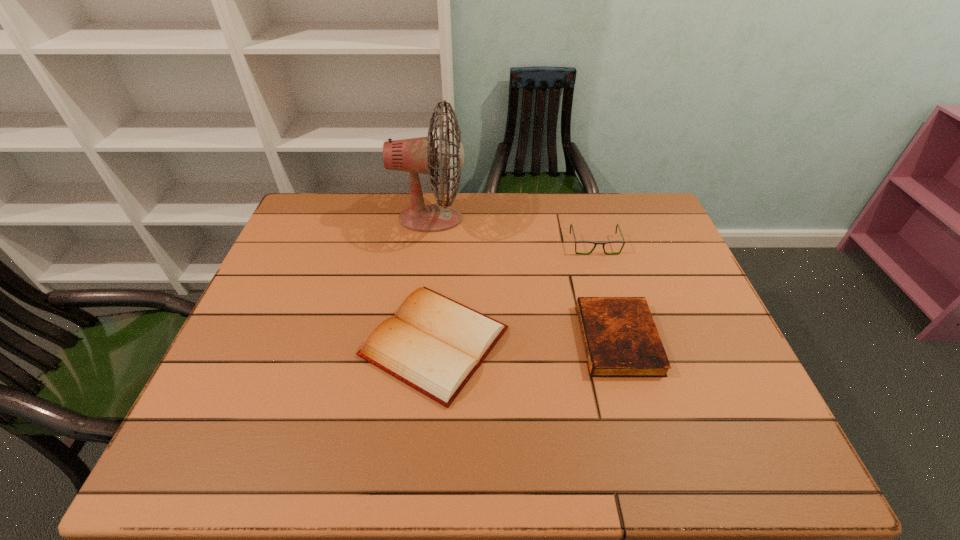
At what (x,y) coordinates should I click in order to perform the action: click on fan at the far edge. Please return your answer as a coordinate pair (x, y). Image resolution: width=960 pixels, height=540 pixels. Looking at the image, I should click on (416, 155).

Identify the location of spectacles that is at the far edge. This screenshot has height=540, width=960. (582, 241).

Locate an element on the screen. vacant space at the far edge of the desktop is located at coordinates (373, 213).

You are a GUI agent. You are given a task and a screenshot of the screen. Output one action in this format:
    pyautogui.click(x=<x>, y=<y>)
    Task: Click on the vacant space at the near edge of the desktop
    
    Given the screenshot: What is the action you would take?
    pyautogui.click(x=440, y=431)

Locate an element on the screen. The width and height of the screenshot is (960, 540). vacant space at the left edge of the desktop is located at coordinates (276, 267).

This screenshot has width=960, height=540. In the image, there is a desktop. In order to click on vacant area at the right edge in this screenshot , I will do `click(629, 239)`.

What are the coordinates of `free location at the far left corner of the desktop` in the screenshot? It's located at (346, 212).

In the image, there is a desktop. Identify the location of free region at the far right corner. This screenshot has width=960, height=540. (620, 210).

I want to click on vacant area that lies between the left Bible and the spectacles, so click(515, 293).

In order to click on free spot between the tallest object and the third shortest object in this screenshot , I will do `click(513, 232)`.